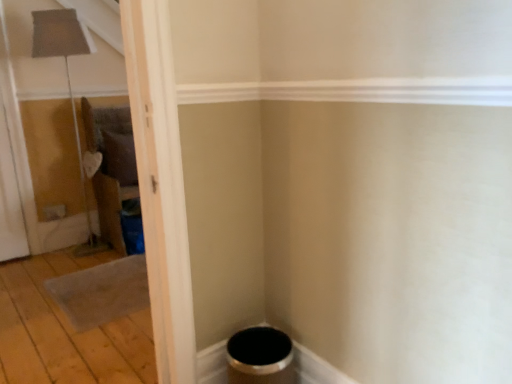
Question: Considering the positions of point (11, 150) and point (31, 259), is point (11, 150) closer or farther from the camera than point (31, 259)?

Choices:
 (A) closer
 (B) farther

Answer: (A)

Question: From the image's perspective, is transparent plastic screen door at left above or below wooden floor at lower left?

Choices:
 (A) below
 (B) above

Answer: (B)

Question: Looking at their shapes, would you say transparent plastic screen door at left is wider or thinner than wooden floor at lower left?

Choices:
 (A) wide
 (B) thin

Answer: (B)

Question: Visually, is wooden floor at lower left positioned to the left or to the right of transparent plastic screen door at left?

Choices:
 (A) right
 (B) left

Answer: (A)

Question: In terms of height, does wooden floor at lower left look taller or shorter compared to transparent plastic screen door at left?

Choices:
 (A) tall
 (B) short

Answer: (B)

Question: Is point (48, 271) closer or farther from the camera than point (8, 190)?

Choices:
 (A) closer
 (B) farther

Answer: (A)

Question: Do you think wooden floor at lower left is within transparent plastic screen door at left, or outside of it?

Choices:
 (A) inside
 (B) outside

Answer: (B)